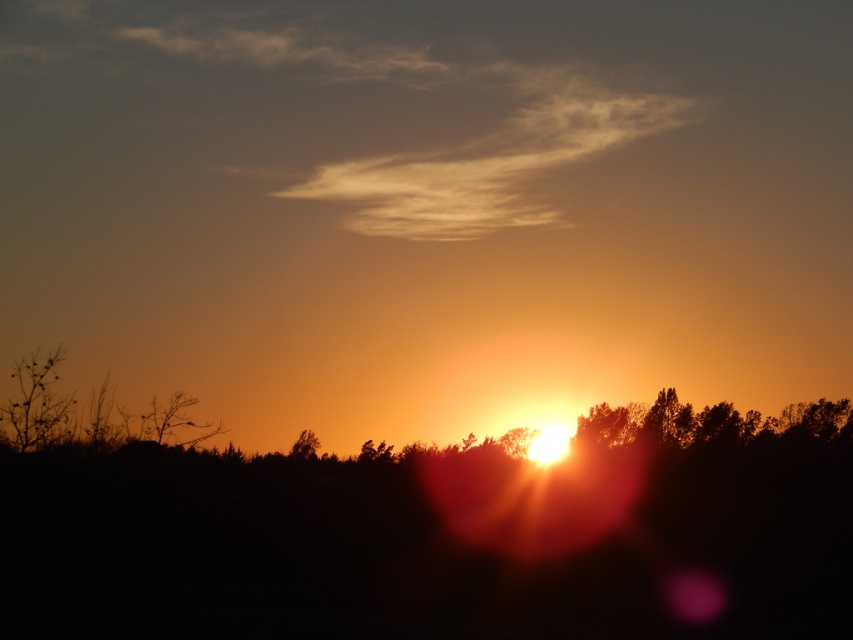
Question: Is bare branches at left to the left of silky brown tree at center from the viewer's perspective?

Choices:
 (A) no
 (B) yes

Answer: (B)

Question: Can you confirm if bare branches at left is thinner than silky brown tree at center?

Choices:
 (A) yes
 (B) no

Answer: (B)

Question: Among these points, which one is nearest to the camera?

Choices:
 (A) (9, 413)
 (B) (315, 444)

Answer: (A)

Question: Which point is farther to the camera?

Choices:
 (A) silky brown tree at center
 (B) bare branches at left

Answer: (A)

Question: Is bare branches at left thinner than silky brown tree at center?

Choices:
 (A) yes
 (B) no

Answer: (B)